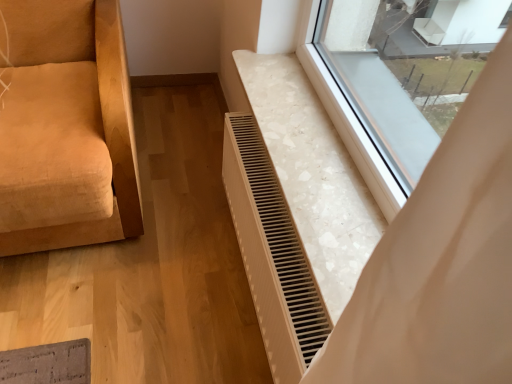
I want to click on white matte radiator at lower center, so click(272, 253).

What do you see at coordinates (272, 253) in the screenshot? I see `white matte radiator at lower center` at bounding box center [272, 253].

Where is `white matte radiator at lower center`? This screenshot has width=512, height=384. white matte radiator at lower center is located at coordinates coord(272,253).